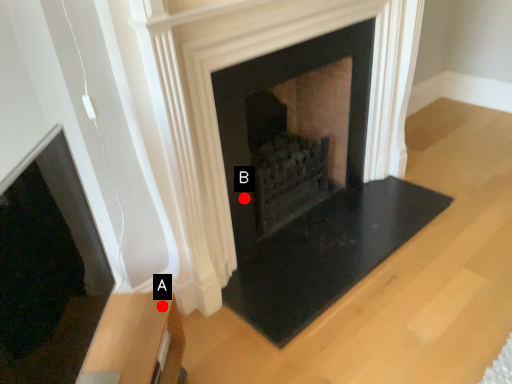
Question: Two points are circled on the image, labeled by A and B beside each circle. Which of the following is the farthest from the observer?

Choices:
 (A) A is further
 (B) B is further

Answer: (B)